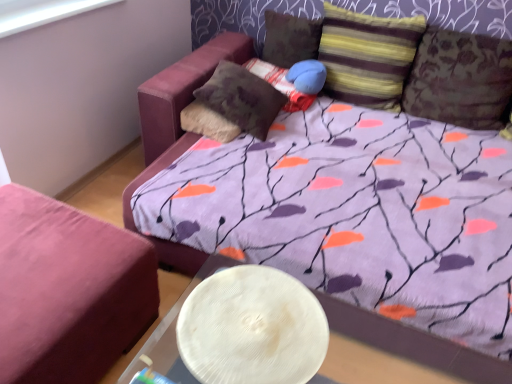
This screenshot has width=512, height=384. Identify the location of free point above white textured plate at lower center (from a real-world perspective). (250, 320).